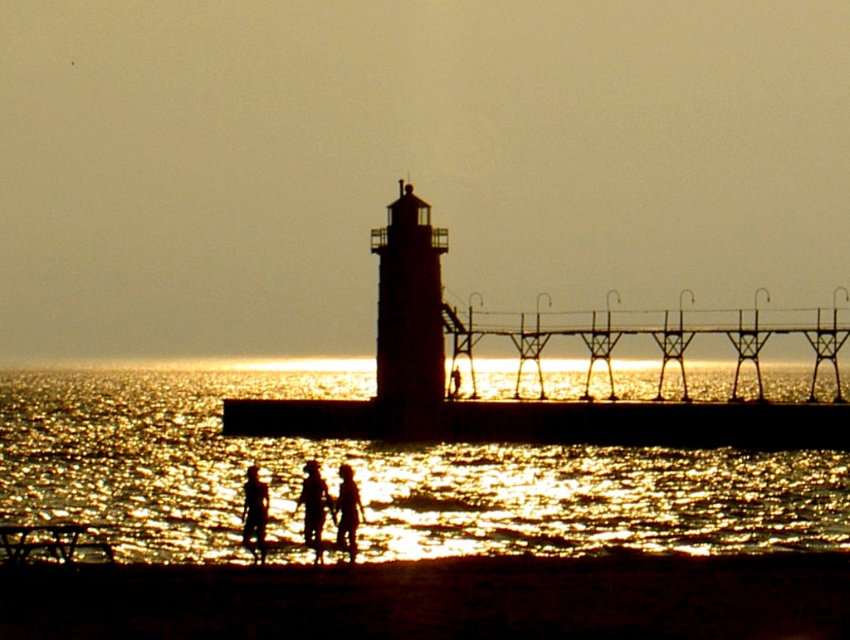
You are standing on the pier looking towards the lighthouse. There are two points marked in the image, one at coordinates point (693, 621) and another at point (343, 486). Which point is closer to you?

Point (693, 621) is closer to the viewer than point (343, 486).

You are standing at the edge of the pier and want to walk to the lighthouse. There are two points marked on your map as point 1 at coordinates point (825, 493) and point 2 at coordinates point (310, 499). Which point should you avoid stepping on to stay closer to the lighthouse?

You should avoid stepping on point 2 at coordinates point (310, 499) because point 1 at coordinates point (825, 493) is closer to the lighthouse as it is further to the viewer, meaning it is nearer in the scene.